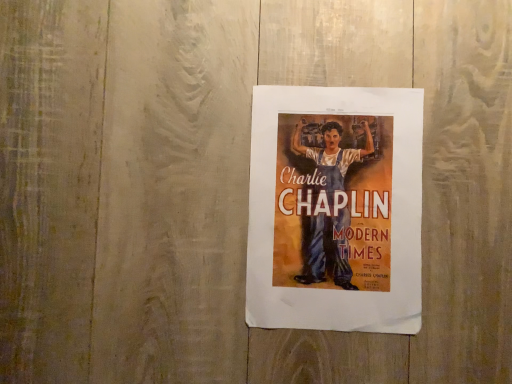
What are the coordinates of `blank space above matte paper poster at center (from a real-world perspective)` in the screenshot? It's located at (337, 209).